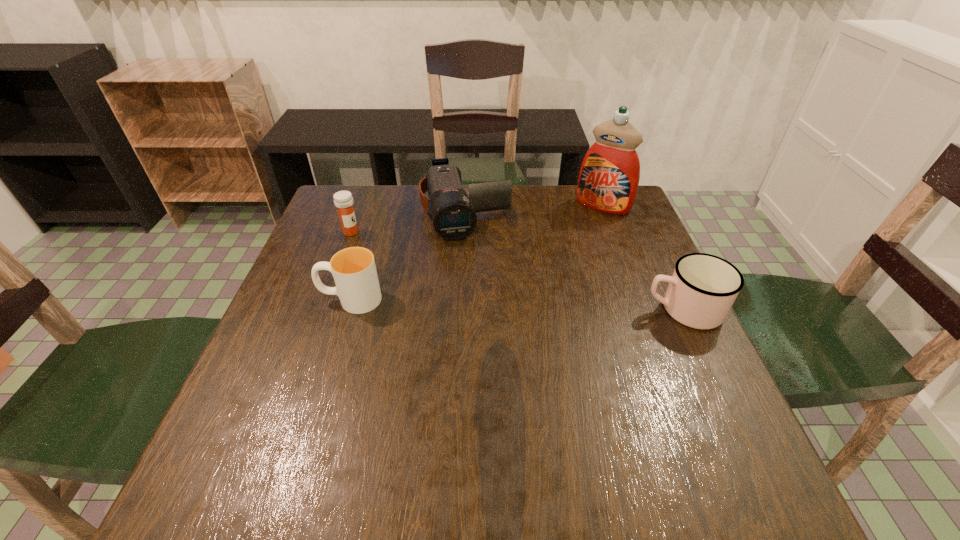
At what (x,y) coordinates should I click in order to perform the action: click on vacant area that lies between the tallest object and the cup. Please return your answer as a coordinate pair (x, y). This screenshot has height=540, width=960. Looking at the image, I should click on (477, 253).

Where is `vacant space that's between the detergent and the camcorder`? vacant space that's between the detergent and the camcorder is located at coordinates (534, 209).

The image size is (960, 540). Identify the location of the fourth closest object relative to the detergent. (343, 200).

Identify which object is the fourth nearest to the third object from left to right. Please provide its 2D coordinates. Your answer should be formatted as a tuple, i.e. [(x, y)], where the tuple contains the x and y coordinates of a point satisfying the conditions above.

[(702, 289)]

Find the location of a particular element. vacant area in the image that satisfies the following two spatial constraints: 1. on the front side of the medicine; 2. with the handle on the side of the cup is located at coordinates (326, 299).

This screenshot has width=960, height=540. What are the coordinates of `vacant region that satisfies the following two spatial constraints: 1. on the back side of the third object from right to left; 2. on the right side of the medicine` in the screenshot? It's located at (358, 212).

At what (x,y) coordinates should I click in order to perform the action: click on free location that satisfies the following two spatial constraints: 1. on the front side of the mug; 2. on the side of the medicine with the handle. Please return your answer as a coordinate pair (x, y). This screenshot has width=960, height=540. Looking at the image, I should click on (323, 309).

At what (x,y) coordinates should I click in order to perform the action: click on free space that satisfies the following two spatial constraints: 1. on the back side of the medicine; 2. on the left side of the camcorder. Please return your answer as a coordinate pair (x, y). Looking at the image, I should click on (358, 212).